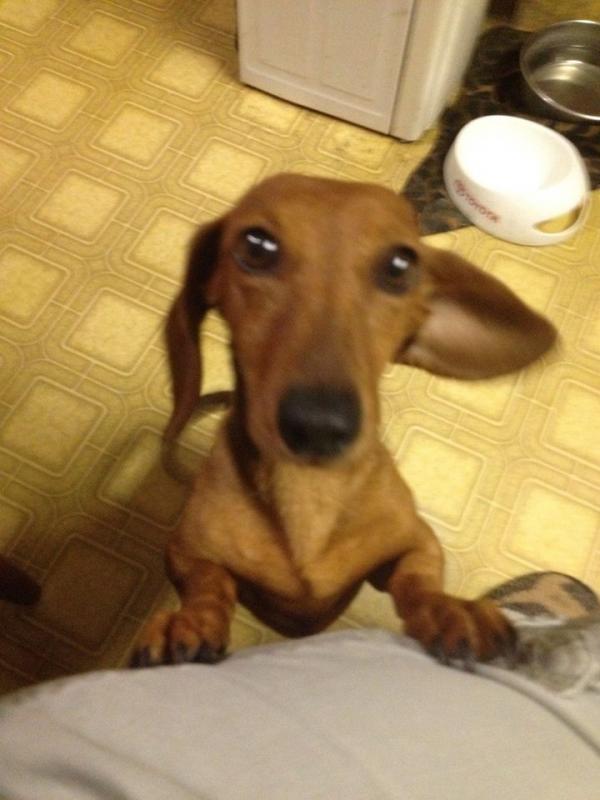
You are a GUI agent. You are given a task and a screenshot of the screen. Output one action in this format:
    pyautogui.click(x=<x>, y=<y>)
    Task: Click on the nasty yellowish floor
    This screenshot has width=600, height=800.
    Given the screenshot: What is the action you would take?
    pyautogui.click(x=275, y=124)